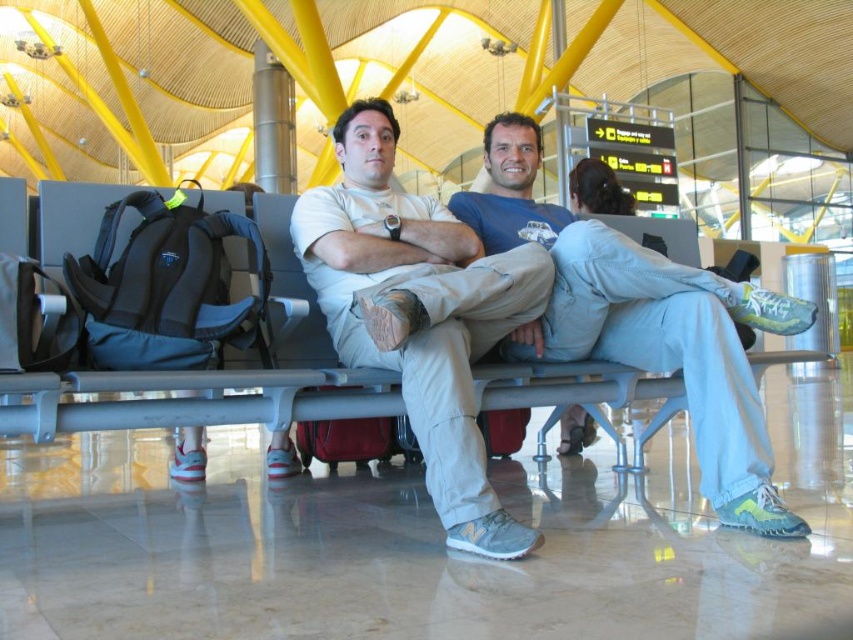
You are a traveler who just arrived at the airport terminal. You see the light blue denim jeans at center and the maroon fabric suitcase at center. If you want to pick up your suitcase, which one should you approach?

The maroon fabric suitcase at center is the one you should approach. The light blue denim jeans at center is 4.15 feet away from the maroon fabric suitcase at center, so the suitcase is farther away from you than the jeans.

Based on the provided scene description, where is the light blue denim jeans at center located in terms of coordinates?

The light blue denim jeans at center is located at coordinates point (x=635, y=323).